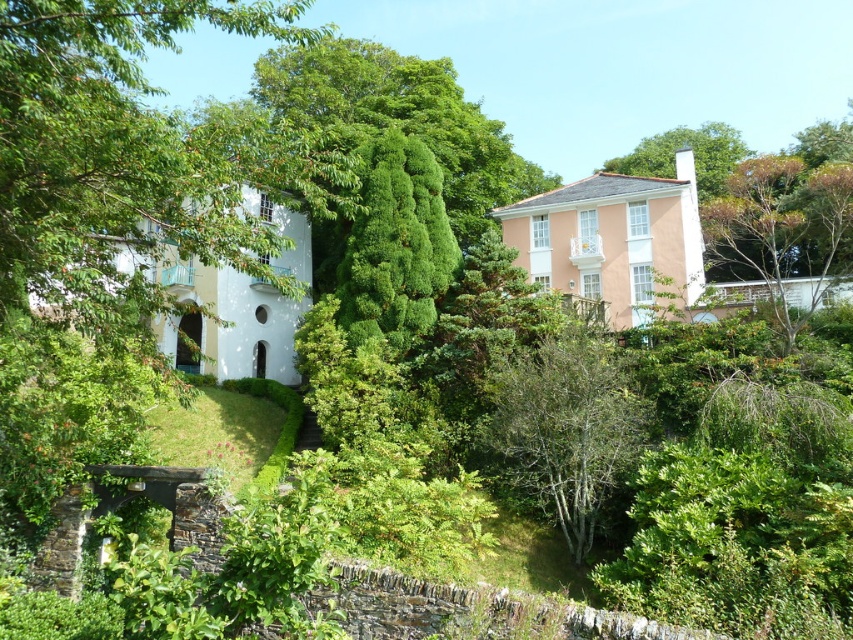
You are standing at the point with coordinates point (579, 440) and want to walk towards the point with coordinates point (647, 138). Which direction should you face to walk towards the second point?

You should face north to walk towards the point (647, 138) from point (579, 440) because point (579, 440) is in front of point (647, 138).

Consider the image. You are standing in the middle of the two houses and looking towards the upper right corner of the image. Which tree, the brown textured tree at upper right or the green leafy tree at upper right, is closer to you?

The brown textured tree at upper right is closer to you because it is positioned below the green leafy tree at upper right, indicating it is in front.